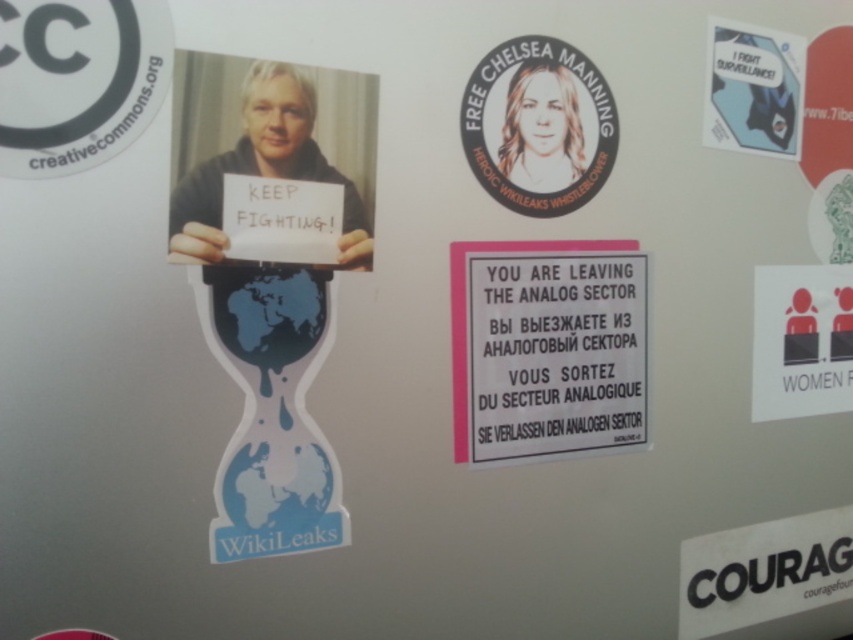
Question: Among these points, which one is nearest to the camera?

Choices:
 (A) (469, 337)
 (B) (751, 106)
 (C) (817, 413)
 (D) (527, 100)

Answer: (A)

Question: Which is nearer to the smooth white portrait at upper center?

Choices:
 (A) white paper sign at center
 (B) blue glossy sticker at upper right

Answer: (A)

Question: Which of the following is the farthest from the observer?

Choices:
 (A) blue glossy sticker at upper right
 (B) white paper sign at right
 (C) smooth white portrait at upper center
 (D) white paper sign at center

Answer: (B)

Question: Is white paper sign at right below blue glossy sticker at upper right?

Choices:
 (A) yes
 (B) no

Answer: (A)

Question: From the image, what is the correct spatial relationship of white paper sign at center in relation to white paper sign at right?

Choices:
 (A) right
 (B) left

Answer: (B)

Question: Considering the relative positions of white paper sign at right and smooth white portrait at upper center in the image provided, where is white paper sign at right located with respect to smooth white portrait at upper center?

Choices:
 (A) above
 (B) below

Answer: (B)